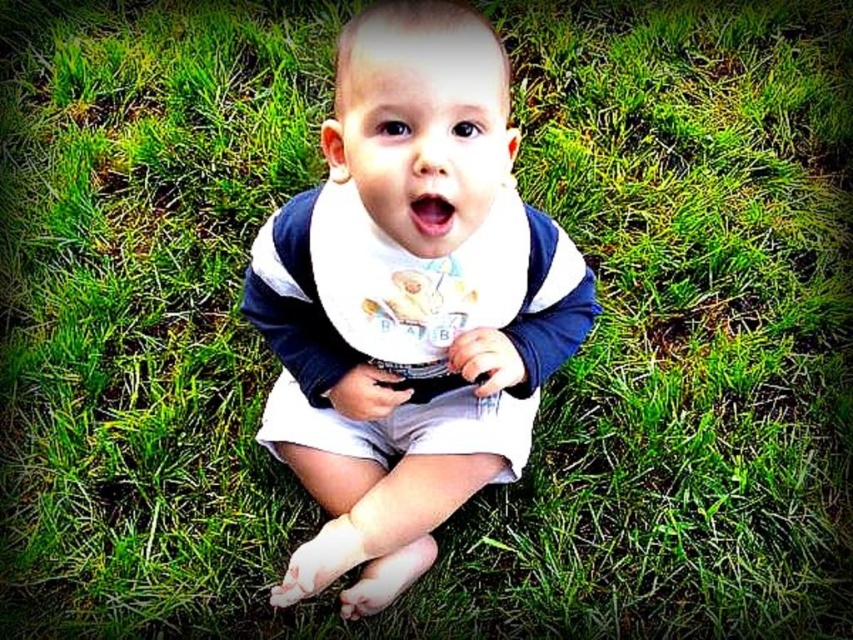
Can you confirm if white soft bib at center is bigger than white fabric bib at center?

Indeed, white soft bib at center has a larger size compared to white fabric bib at center.

Can you confirm if white soft bib at center is wider than white fabric bib at center?

Yes, white soft bib at center is wider than white fabric bib at center.

You are a GUI agent. You are given a task and a screenshot of the screen. Output one action in this format:
    pyautogui.click(x=<x>, y=<y>)
    Task: Click on the white soft bib at center
    
    Given the screenshot: What is the action you would take?
    pyautogui.click(x=408, y=300)

Where is `white soft bib at center`? The width and height of the screenshot is (853, 640). white soft bib at center is located at coordinates (408, 300).